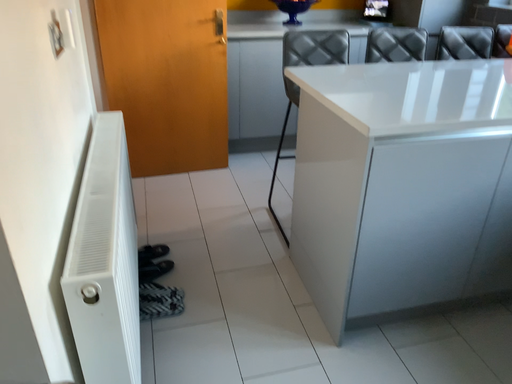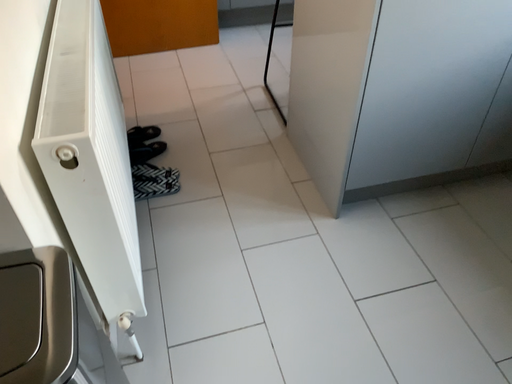
Question: How did the camera likely rotate when shooting the video?

Choices:
 (A) rotated upward
 (B) rotated downward

Answer: (B)